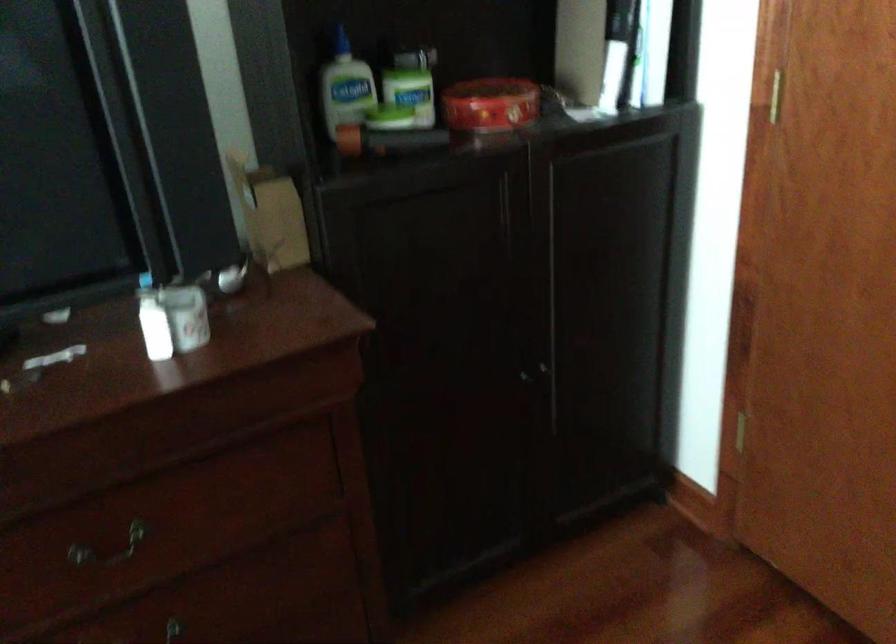
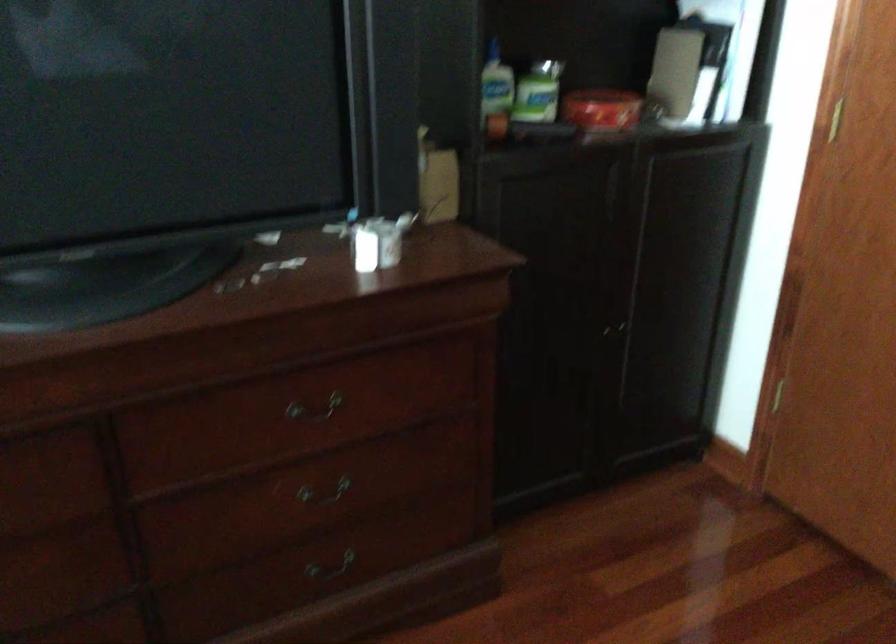
Locate, in the second image, the point that corresponds to (x=134, y=536) in the first image.

(314, 409)